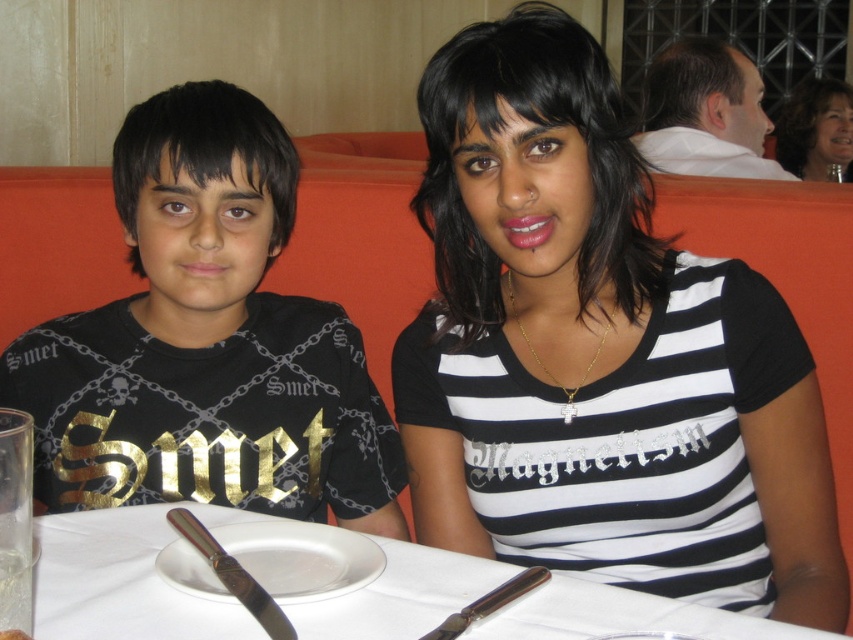
Between point (335, 444) and point (498, 602), which one is positioned behind?

The point (335, 444) is behind.

Does point (282, 332) lie in front of point (518, 596)?

No, (282, 332) is behind (518, 596).

Does point (173, 241) come closer to viewer compared to point (486, 612)?

No, it is not.

The width and height of the screenshot is (853, 640). I want to click on black matte shirt at left, so click(207, 342).

Does white paper table at center have a lesser height compared to matte black hair at upper right?

Yes, white paper table at center is shorter than matte black hair at upper right.

Can you confirm if white paper table at center is thinner than matte black hair at upper right?

Incorrect, white paper table at center's width is not less than matte black hair at upper right's.

Looking at this image, who is more forward, (144,614) or (821,77)?

Point (144,614) is more forward.

Find the location of a particular element. This screenshot has height=640, width=853. white paper table at center is located at coordinates (120, 582).

Looking at this image, does black matte shirt at left appear on the right side of white paper table at center?

No, black matte shirt at left is not to the right of white paper table at center.

Where is `black matte shirt at left`? This screenshot has width=853, height=640. black matte shirt at left is located at coordinates (207, 342).